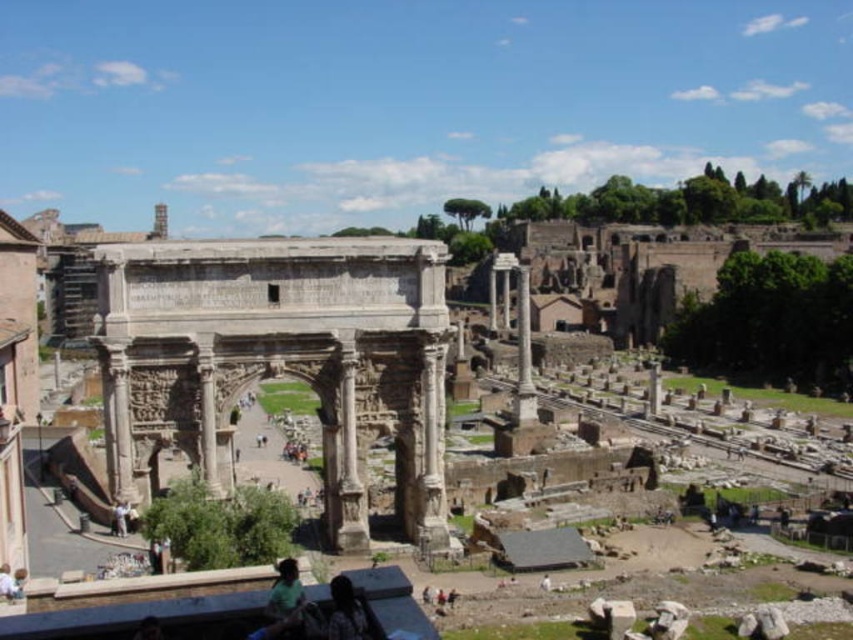
Question: Which object is farther from the camera taking this photo?

Choices:
 (A) smooth stone column at center
 (B) carved stone column at center
 (C) dark hair at lower center

Answer: (A)

Question: Which point appears farthest from the camera in this image?

Choices:
 (A) (111, 273)
 (B) (349, 612)
 (C) (518, 269)

Answer: (C)

Question: Does carved stone column at center appear on the right side of dark hair at lower center?

Choices:
 (A) yes
 (B) no

Answer: (A)

Question: Is carved stone arch at center positioned before dark hair at lower center?

Choices:
 (A) yes
 (B) no

Answer: (B)

Question: Which point is farther to the camera?

Choices:
 (A) click(x=418, y=508)
 (B) click(x=393, y=348)
 (C) click(x=354, y=355)
 (D) click(x=520, y=352)

Answer: (D)

Question: Is the position of stone arch at center more distant than that of dark hair at lower center?

Choices:
 (A) yes
 (B) no

Answer: (A)